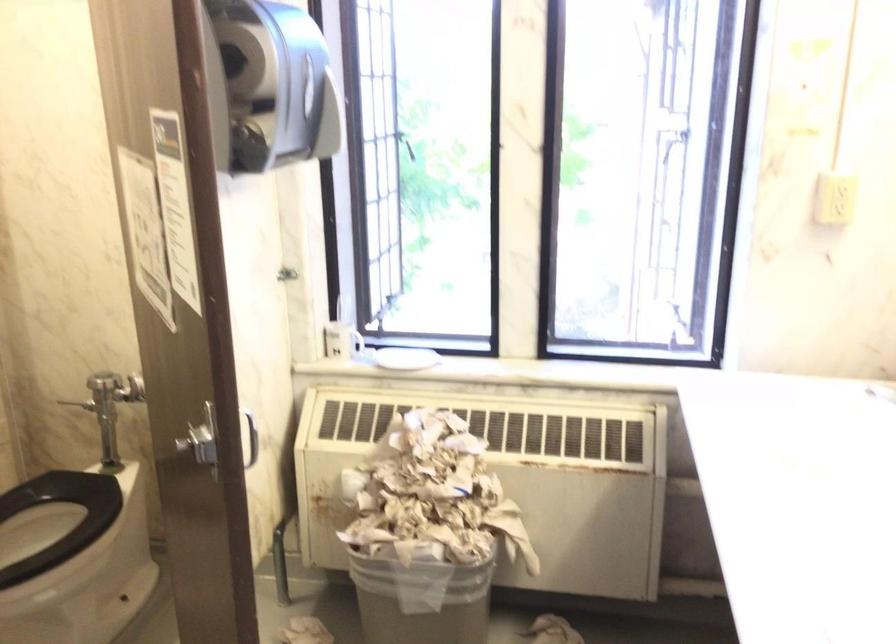
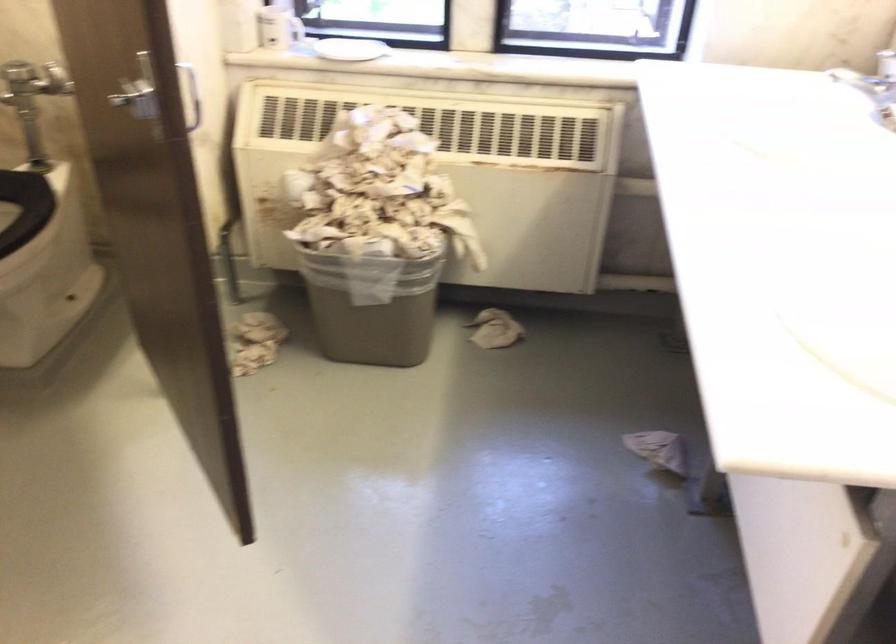
Locate, in the second image, the point that corresponds to point (406, 359) in the first image.

(349, 49)